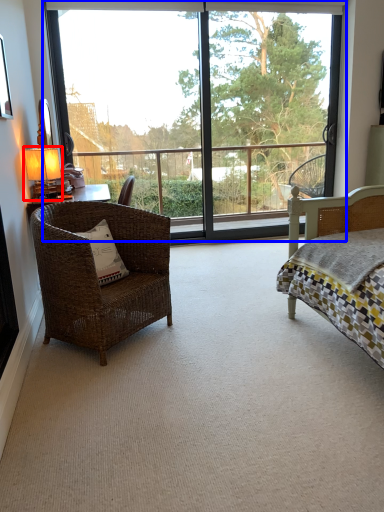
Question: Which point is closer to the camera, table lamp (highlighted by a red box) or window (highlighted by a blue box)?

Choices:
 (A) table lamp
 (B) window

Answer: (A)